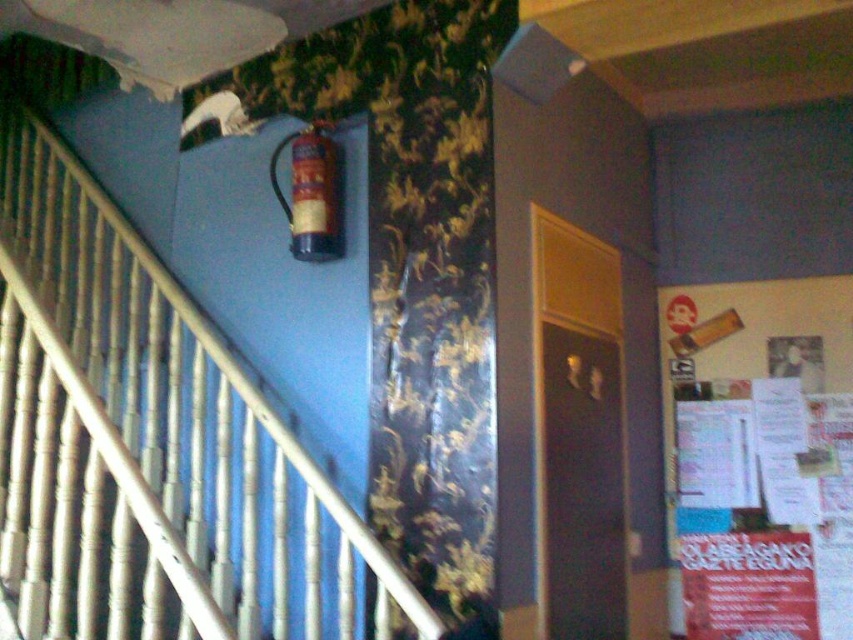
You are standing at the bottom of the staircase and want to reach the metallic gold extinguisher at upper center. However, there is a white paper poster at right in your path. Can you walk directly to the extinguisher without moving the poster?

The metallic gold extinguisher at upper center is behind the white paper poster at right, so you cannot walk directly to it without moving the poster.

You are an interior designer assessing the placement of the white matte railing at upper left and the metallic gold extinguisher at upper center. Which object is closer to the viewer in the image?

The white matte railing at upper left is closer to the viewer than the metallic gold extinguisher at upper center because it is in front of it.

You are standing at the bottom of the staircase and want to hang a new poster. The white matte railing at upper left and the white paper poster at right are already present. Which object is closer to you, the viewer, so you know where to place your new poster?

The white matte railing at upper left is closer to the viewer than the white paper poster at right, so it is nearer to you. When placing your new poster, ensure it is positioned appropriately relative to these existing items.